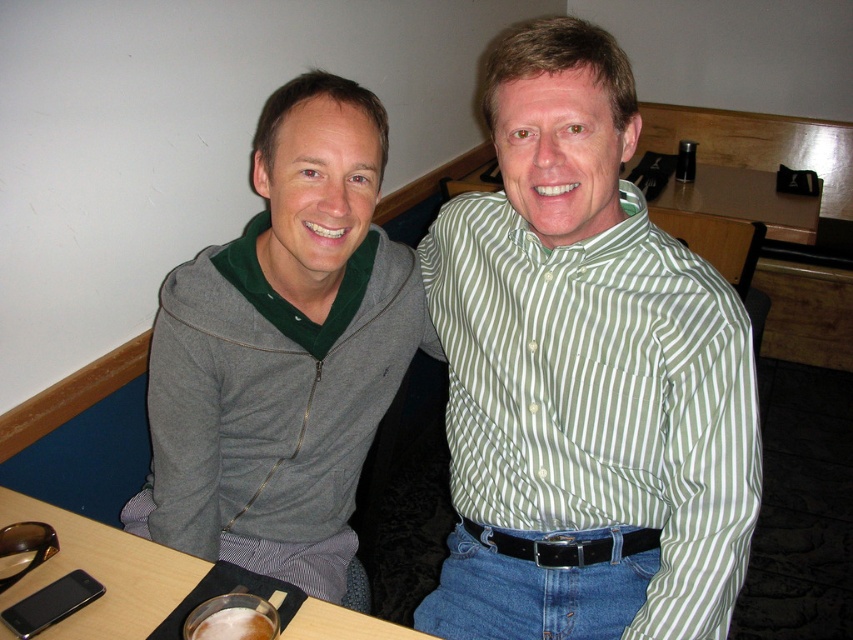
Question: Which of the following is the closest to the observer?

Choices:
 (A) gray zip-up hoodie at left
 (B) green striped shirt at center
 (C) black plastic phone at lower left

Answer: (B)

Question: Is gray zip-up hoodie at left smaller than black plastic phone at lower left?

Choices:
 (A) no
 (B) yes

Answer: (A)

Question: Does gray zip-up hoodie at left appear on the right side of black plastic phone at lower left?

Choices:
 (A) yes
 (B) no

Answer: (A)

Question: Which of these objects is positioned farthest from the black plastic phone at lower left?

Choices:
 (A) green striped shirt at center
 (B) gray zip-up hoodie at left

Answer: (A)

Question: Among these points, which one is nearest to the camera?

Choices:
 (A) coord(108,579)
 (B) coord(587,26)

Answer: (B)

Question: Is gray zip-up hoodie at left closer to the viewer compared to black plastic phone at lower left?

Choices:
 (A) no
 (B) yes

Answer: (A)